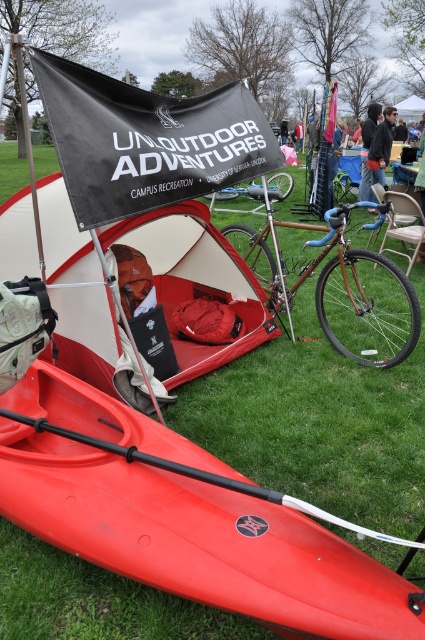
You are standing at the point with coordinates point (410, 116) and want to walk to the point (336, 300). According to the scene description, which direction should you move to reach your destination?

You should move forward because point (336, 300) is in front of point (410, 116).

You are planning to carry both the wooden frame bicycle at center and the white fabric canopy at upper center in your pickup truck. The truck bed is 1.5 meters wide. Can both items fit side by side without overlapping?

The wooden frame bicycle at center is wider than the white fabric canopy at upper center. Since the truck bed is 1.5 meters wide, you need to check if the combined width of both items is less than or equal to 1.5 meters. However, without knowing the exact widths of each item, it is impossible to determine if they can fit side by side.

Looking at this image, you are planning to take a photo of the wooden frame bicycle at center and the white fabric canopy at upper center. Which object should you focus on first if you want to capture both in a single shot without moving the camera?

You should focus on the wooden frame bicycle at center first because it is larger in size than the white fabric canopy at upper center, making it more prominent in the composition.